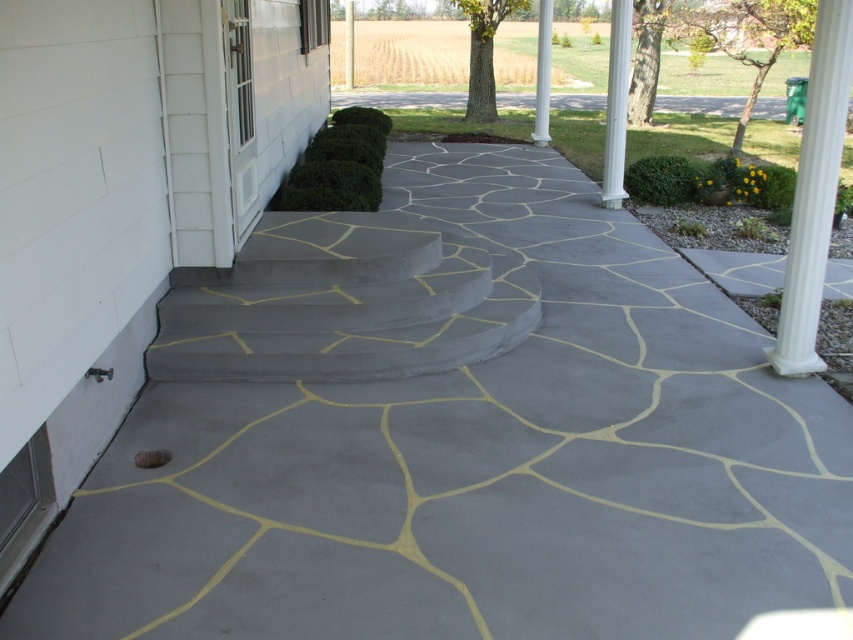
Question: Can you confirm if gray concrete stairs at center is positioned to the right of white smooth column at upper center?

Choices:
 (A) yes
 (B) no

Answer: (B)

Question: Estimate the real-world distances between objects in this image. Which object is closer to the white smooth column at right?

Choices:
 (A) gray concrete stairs at center
 (B) white smooth column at upper center

Answer: (A)

Question: Does white smooth column at upper center come behind gray concrete pillar at center?

Choices:
 (A) yes
 (B) no

Answer: (B)

Question: Which of the following is the closest to the observer?

Choices:
 (A) white smooth column at center
 (B) gray concrete pillar at center
 (C) white smooth column at right
 (D) gray concrete stairs at center

Answer: (C)

Question: Does gray concrete stairs at center appear on the left side of white smooth column at upper center?

Choices:
 (A) no
 (B) yes

Answer: (B)

Question: Which is farther from the gray concrete stairs at center?

Choices:
 (A) white smooth column at right
 (B) white smooth column at center
 (C) white smooth column at upper center

Answer: (C)